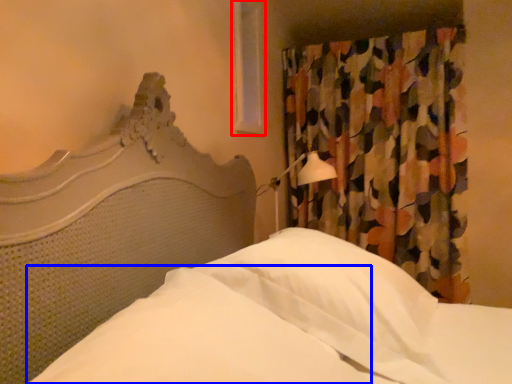
Question: Which of the following is the closest to the observer, window (highlighted by a red box) or sheet (highlighted by a blue box)?

Choices:
 (A) window
 (B) sheet

Answer: (B)